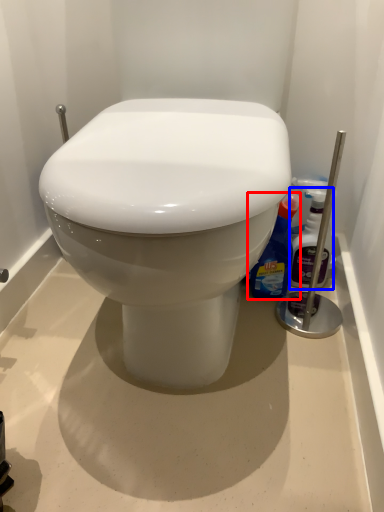
Question: Which object appears farthest to the camera in this image, cleaning product (highlighted by a red box) or cleaning product (highlighted by a blue box)?

Choices:
 (A) cleaning product
 (B) cleaning product

Answer: (B)